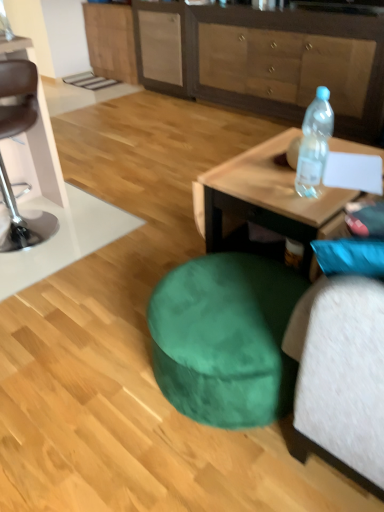
Question: Is wooden coffee table at right at the right side of wooden cabinet at upper center, marked as the first cabinetry in a front-to-back arrangement?

Choices:
 (A) yes
 (B) no

Answer: (B)

Question: Can you confirm if wooden coffee table at right is smaller than wooden cabinet at upper center, which ranks as the second cabinetry in back-to-front order?

Choices:
 (A) no
 (B) yes

Answer: (B)

Question: Are wooden coffee table at right and wooden cabinet at upper center, which appears as the 2th cabinetry when viewed from the left, making contact?

Choices:
 (A) yes
 (B) no

Answer: (B)

Question: Considering the relative sizes of wooden coffee table at right and wooden cabinet at upper center, which appears as the 2th cabinetry when viewed from the left, in the image provided, is wooden coffee table at right wider than wooden cabinet at upper center, which appears as the 2th cabinetry when viewed from the left,?

Choices:
 (A) no
 (B) yes

Answer: (B)

Question: Considering the relative sizes of wooden coffee table at right and wooden cabinet at upper center, marked as the first cabinetry in a front-to-back arrangement, in the image provided, is wooden coffee table at right thinner than wooden cabinet at upper center, marked as the first cabinetry in a front-to-back arrangement,?

Choices:
 (A) yes
 (B) no

Answer: (B)

Question: From a real-world perspective, is brown leather bar stool at left above or below velvet green bean bag at lower center?

Choices:
 (A) above
 (B) below

Answer: (A)

Question: Considering the positions of point (36, 93) and point (175, 406), is point (36, 93) closer or farther from the camera than point (175, 406)?

Choices:
 (A) farther
 (B) closer

Answer: (A)

Question: Looking at their shapes, would you say brown leather bar stool at left is wider or thinner than velvet green bean bag at lower center?

Choices:
 (A) wide
 (B) thin

Answer: (A)

Question: Considering their positions, is brown leather bar stool at left located in front of or behind velvet green bean bag at lower center?

Choices:
 (A) behind
 (B) front

Answer: (A)

Question: Would you say wooden cabinet at upper center, marked as the first cabinetry in a front-to-back arrangement, is to the left or to the right of matte wood cabinet at upper center, placed as the first cabinetry when sorted from left to right, in the picture?

Choices:
 (A) left
 (B) right

Answer: (B)

Question: From the image's perspective, is wooden cabinet at upper center, which ranks as the second cabinetry in back-to-front order, above or below matte wood cabinet at upper center, positioned as the 2th cabinetry in right-to-left order?

Choices:
 (A) above
 (B) below

Answer: (B)

Question: Is point (185, 39) closer or farther from the camera than point (130, 13)?

Choices:
 (A) farther
 (B) closer

Answer: (B)

Question: Do you think wooden cabinet at upper center, marked as the first cabinetry in a front-to-back arrangement, is within matte wood cabinet at upper center, placed as the first cabinetry when sorted from left to right, or outside of it?

Choices:
 (A) outside
 (B) inside

Answer: (A)

Question: Is wooden cabinet at upper center, which appears as the 2th cabinetry when viewed from the left, in front of or behind transparent plastic bottle at upper right in the image?

Choices:
 (A) front
 (B) behind

Answer: (B)

Question: From a real-world perspective, relative to transparent plastic bottle at upper right, is wooden cabinet at upper center, which appears as the 2th cabinetry when viewed from the left, vertically above or below?

Choices:
 (A) above
 (B) below

Answer: (B)